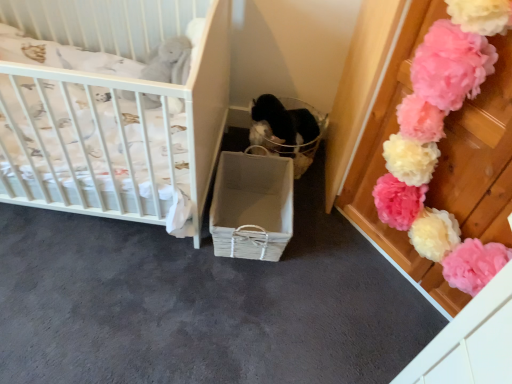
Question: In terms of size, does translucent plastic basket at center appear bigger or smaller than white wicker crib at left?

Choices:
 (A) big
 (B) small

Answer: (B)

Question: In terms of width, does translucent plastic basket at center look wider or thinner when compared to white wicker crib at left?

Choices:
 (A) thin
 (B) wide

Answer: (A)

Question: Which is nearer to the white wicker crib at left?

Choices:
 (A) white wicker basket at center
 (B) translucent plastic basket at center
 (C) pink fluffy pom-pom at upper right

Answer: (A)

Question: Estimate the real-world distances between objects in this image. Which object is farther from the white wicker basket at center?

Choices:
 (A) pink fluffy pom-pom at upper right
 (B) translucent plastic basket at center
 (C) white wicker crib at left

Answer: (A)